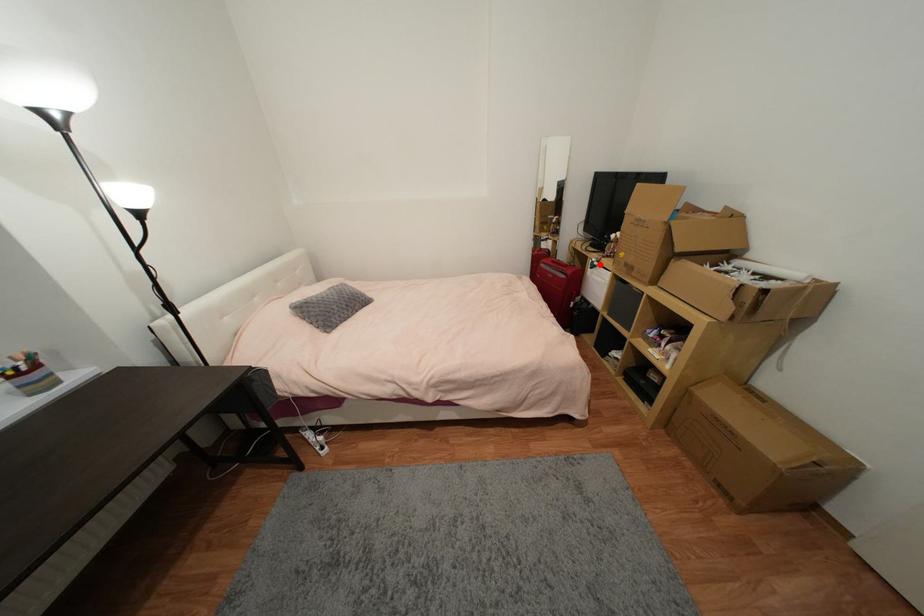
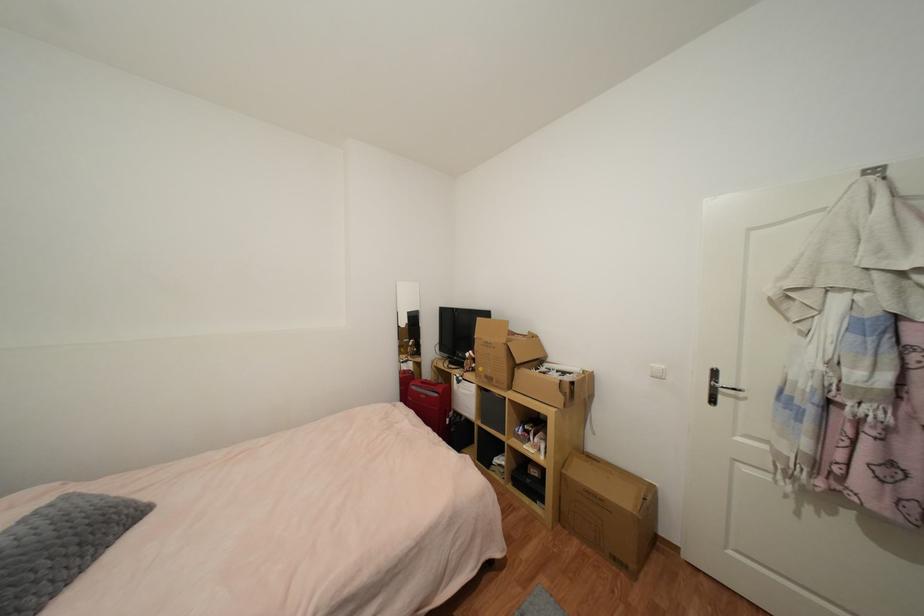
Locate, in the second image, the point that corresponds to the highlighted location in the first image.

(465, 379)